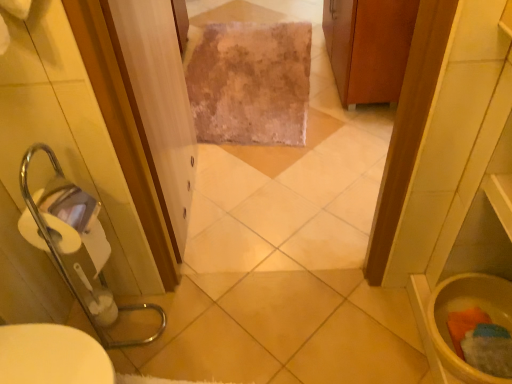
Question: Is wooden cabinet at upper right in front of or behind yellow matte toilet bowl at lower right in the image?

Choices:
 (A) front
 (B) behind

Answer: (B)

Question: Looking at their shapes, would you say wooden cabinet at upper right is wider or thinner than yellow matte toilet bowl at lower right?

Choices:
 (A) wide
 (B) thin

Answer: (A)

Question: Considering the real-world distances, which object is farthest from the fuzzy beige rug at center?

Choices:
 (A) wooden cabinet at upper right
 (B) yellow matte toilet bowl at lower right
 (C) clear plastic screen door at center

Answer: (B)

Question: Estimate the real-world distances between objects in this image. Which object is farther from the clear plastic screen door at center?

Choices:
 (A) fuzzy beige rug at center
 (B) yellow matte toilet bowl at lower right
 (C) wooden cabinet at upper right

Answer: (B)